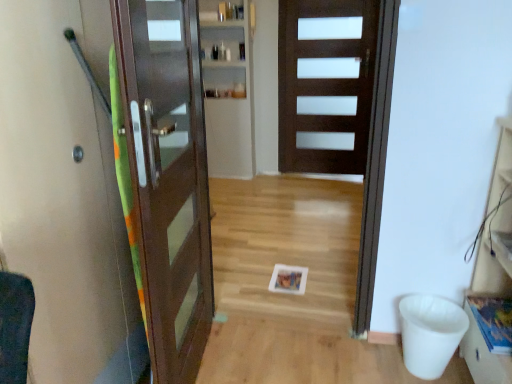
Question: Can you confirm if dark wood door at center, positioned as the 1th door in right-to-left order, is smaller than wooden drawer at lower right?

Choices:
 (A) yes
 (B) no

Answer: (B)

Question: Is dark wood door at center, arranged as the 2th door when viewed from the left, outside of wooden drawer at lower right?

Choices:
 (A) yes
 (B) no

Answer: (A)

Question: Is dark wood door at center, positioned as the 1th door in right-to-left order, directly adjacent to wooden drawer at lower right?

Choices:
 (A) no
 (B) yes

Answer: (A)

Question: Considering the relative sizes of dark wood door at center, acting as the first door starting from the back, and wooden drawer at lower right in the image provided, is dark wood door at center, acting as the first door starting from the back, thinner than wooden drawer at lower right?

Choices:
 (A) yes
 (B) no

Answer: (A)

Question: From a real-world perspective, is dark wood door at center, positioned as the 1th door in right-to-left order, positioned over wooden drawer at lower right based on gravity?

Choices:
 (A) yes
 (B) no

Answer: (A)

Question: From the image's perspective, does dark wood door at center, arranged as the 2th door when viewed from the left, appear higher than wooden drawer at lower right?

Choices:
 (A) no
 (B) yes

Answer: (B)

Question: From the image's perspective, is matte brown door at left, placed as the second door when sorted from back to front, on top of wooden drawer at lower right?

Choices:
 (A) no
 (B) yes

Answer: (B)

Question: Is matte brown door at left, placed as the 1th door when sorted from left to right, to the left of wooden drawer at lower right from the viewer's perspective?

Choices:
 (A) no
 (B) yes

Answer: (B)

Question: Is wooden drawer at lower right a part of matte brown door at left, which is the 2th door in right-to-left order?

Choices:
 (A) yes
 (B) no

Answer: (B)

Question: Is the position of matte brown door at left, which is counted as the first door, starting from the front, more distant than that of wooden drawer at lower right?

Choices:
 (A) no
 (B) yes

Answer: (A)

Question: From a real-world perspective, is matte brown door at left, placed as the second door when sorted from back to front, below wooden drawer at lower right?

Choices:
 (A) yes
 (B) no

Answer: (B)

Question: Is matte brown door at left, which is the 2th door in right-to-left order, not within wooden drawer at lower right?

Choices:
 (A) no
 (B) yes

Answer: (B)

Question: Is dark wood door at center, arranged as the 2th door when viewed from the left, not near matte brown door at left, which is the 2th door in right-to-left order?

Choices:
 (A) no
 (B) yes

Answer: (B)